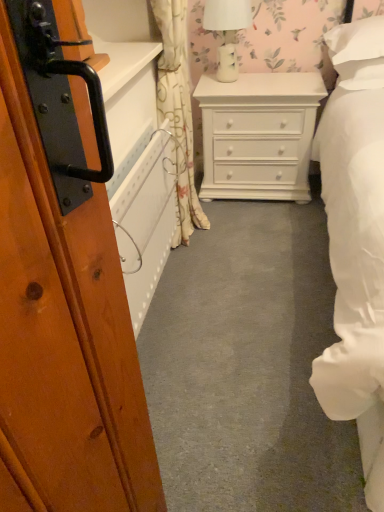
Identify the location of free spot above white painted wood chest of drawers at center (from a real-world perspective). (268, 77).